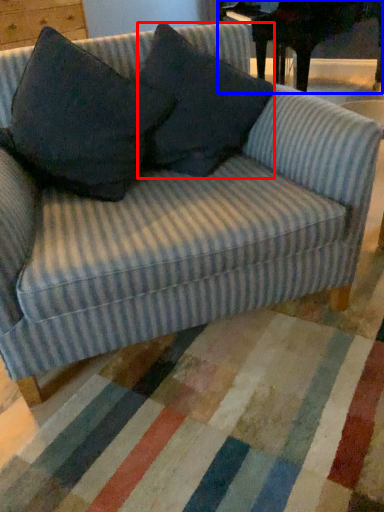
Question: Which of the following is the farthest to the observer, throw pillow (highlighted by a red box) or table (highlighted by a blue box)?

Choices:
 (A) throw pillow
 (B) table

Answer: (B)